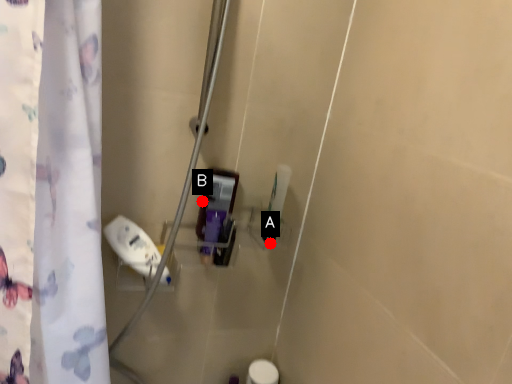
Question: Two points are circled on the image, labeled by A and B beside each circle. Which of the following is the closest to the observer?

Choices:
 (A) A is closer
 (B) B is closer

Answer: (B)